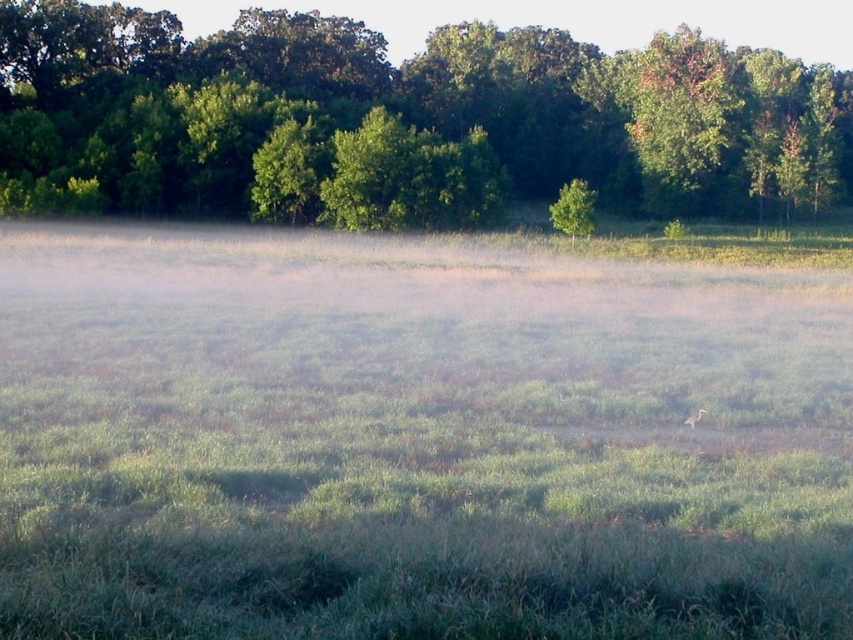
Question: Which point is closer to the camera taking this photo?

Choices:
 (A) (747, 93)
 (B) (575, 230)

Answer: (B)

Question: Considering the relative positions of green grassy field at center and brown feathered bird at center in the image provided, where is green grassy field at center located with respect to brown feathered bird at center?

Choices:
 (A) above
 (B) below

Answer: (A)

Question: Among these points, which one is farthest from the camera?

Choices:
 (A) (720, 70)
 (B) (22, 340)
 (C) (704, 410)

Answer: (A)

Question: Is green leafy tree at upper center wider than green matte tree at center?

Choices:
 (A) yes
 (B) no

Answer: (A)

Question: Which point is closer to the camera?

Choices:
 (A) (688, 420)
 (B) (86, 380)
 (C) (592, 228)
 (D) (4, 67)

Answer: (A)

Question: Is green leafy tree at upper center to the left of brown feathered bird at center from the viewer's perspective?

Choices:
 (A) no
 (B) yes

Answer: (A)